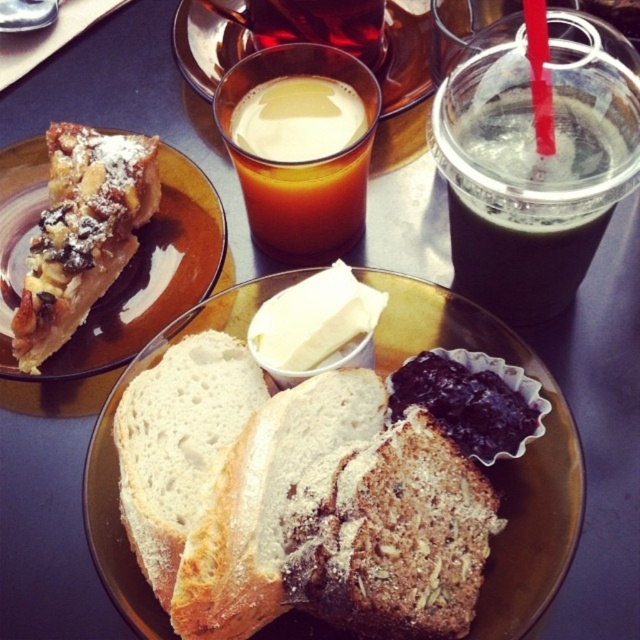
You are a guest at a brunch and want to spread jam on your bread. The bread is on the round amber plate. Which direction should you reach to get the dark purple jam at center relative to the brown liquid at upper center?

The dark purple jam at center is positioned on the right side of brown liquid at upper center, so you should reach to the right of the brown liquid at upper center to get the jam.

You are planning to place a decorative bowl between the powdery brown pastry at upper left and the dark purple jam at center on the table. Based on their sizes, can you estimate whether there will be enough space between them to fit the bowl?

The powdery brown pastry at upper left might be wider than dark purple jam at center, so there may not be enough space between them to fit the bowl unless it is very small.

You are a food critic evaluating the thickness of baked goods in this image. Which of the two items, the powdered brown bread at center or the powdery brown pastry at upper left, is thinner?

The powdered brown bread at center is thinner than the powdery brown pastry at upper left.